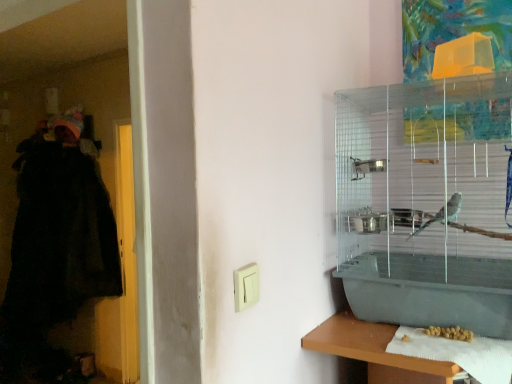
Question: Is point (243, 304) closer or farther from the camera than point (373, 339)?

Choices:
 (A) closer
 (B) farther

Answer: (A)

Question: In terms of size, does white plastic light switch at center appear bigger or smaller than white paper towel at lower right?

Choices:
 (A) big
 (B) small

Answer: (B)

Question: Considering the real-world distances, which object is farthest from the white paper towel at lower right?

Choices:
 (A) yellow matte seeds at lower right
 (B) clear plastic birdcage at upper right
 (C) white plastic light switch at center
 (D) black fuzzy robe at left

Answer: (D)

Question: Which is nearer to the yellow matte seeds at lower right?

Choices:
 (A) white paper towel at lower right
 (B) white plastic light switch at center
 (C) black fuzzy robe at left
 (D) clear plastic birdcage at upper right

Answer: (A)